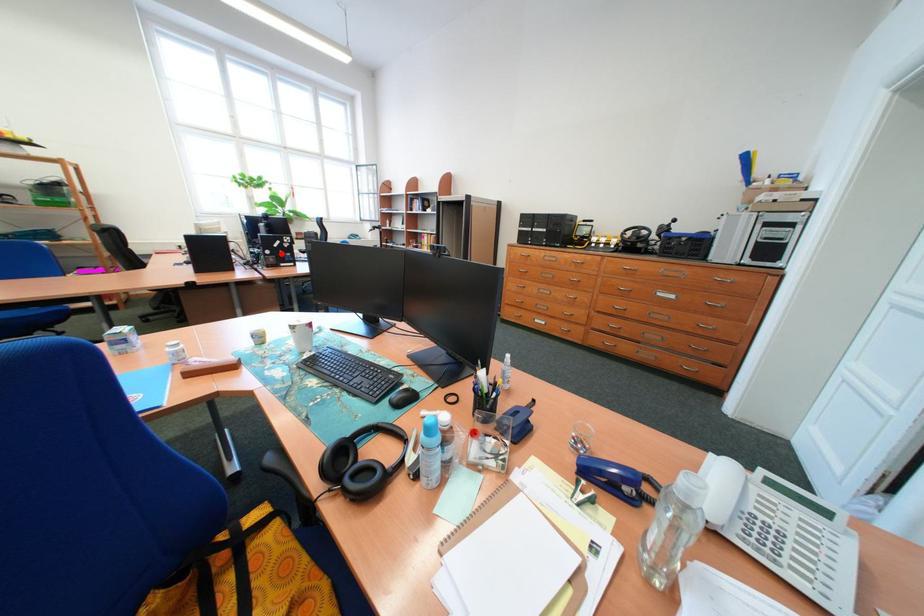
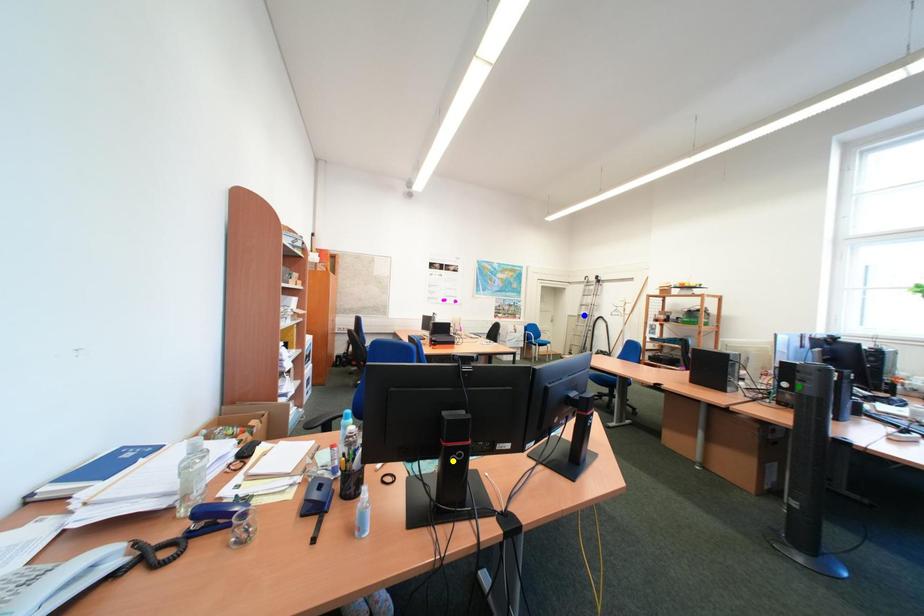
Question: I am providing you with two images of the same scene from different viewpoints. A red point is marked on the first image. You are given multiple points on the second image. Which spot in image 2 lines up with the point in image 1?

Choices:
 (A) green point
 (B) blue point
 (C) yellow point

Answer: (A)